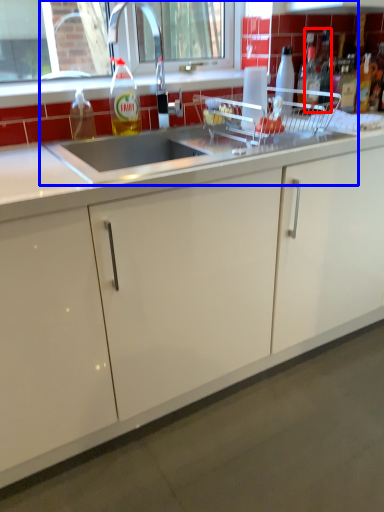
Question: Which of the following is the farthest to the observer, bottle (highlighted by a red box) or sink (highlighted by a blue box)?

Choices:
 (A) bottle
 (B) sink

Answer: (A)